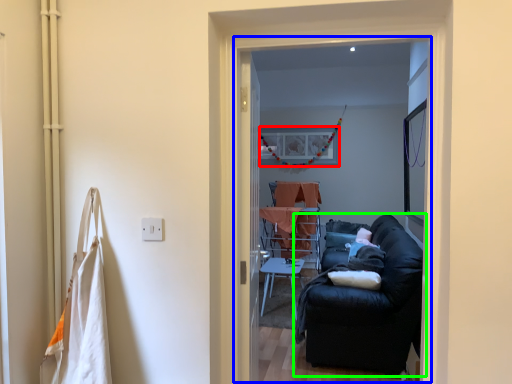
Question: Which object is positioned farthest from picture frame (highlighted by a red box)? Select from screen door (highlighted by a blue box) and studio couch (highlighted by a green box).

Choices:
 (A) screen door
 (B) studio couch

Answer: (B)